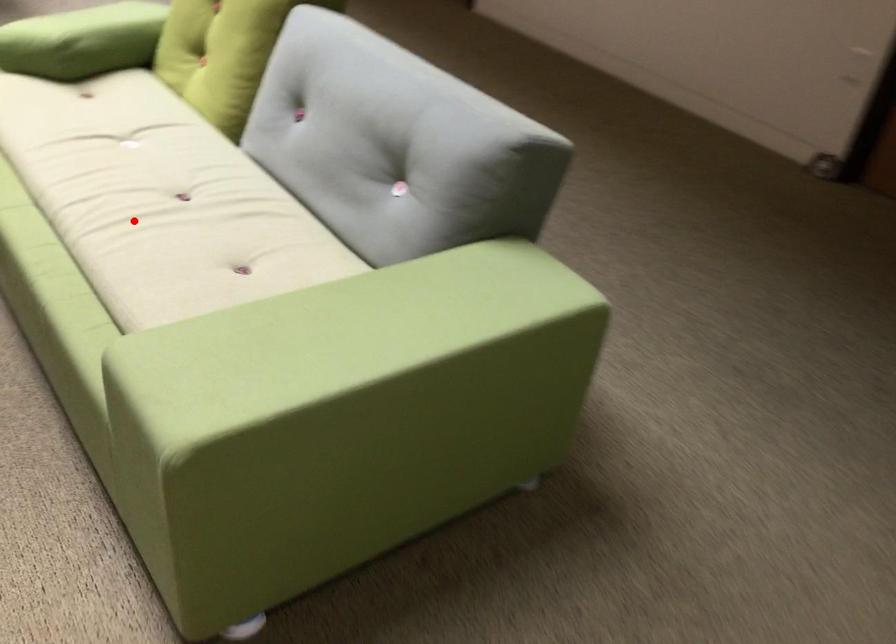
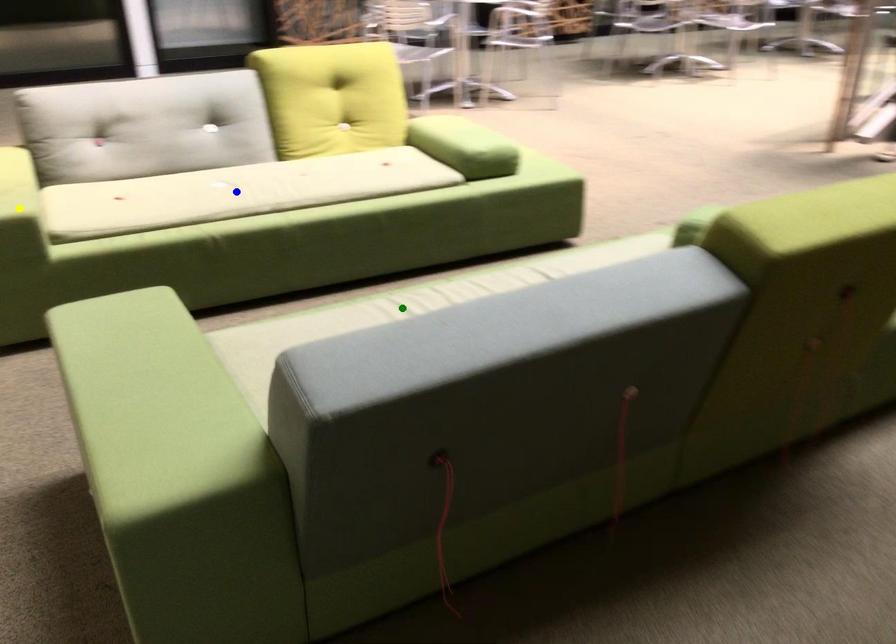
Question: I am providing you with two images of the same scene from different viewpoints. A red point is marked on the first image. You are given multiple points on the second image. In image 2, which mark is for the same physical point as the one in image 1?

Choices:
 (A) yellow point
 (B) green point
 (C) blue point

Answer: (B)